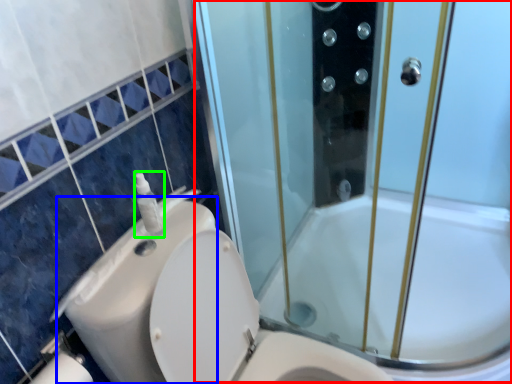
Question: Which object is the closest to the screen door (highlighted by a red box)? Choose among these: sink (highlighted by a blue box) or soap dispenser (highlighted by a green box).

Choices:
 (A) sink
 (B) soap dispenser

Answer: (A)